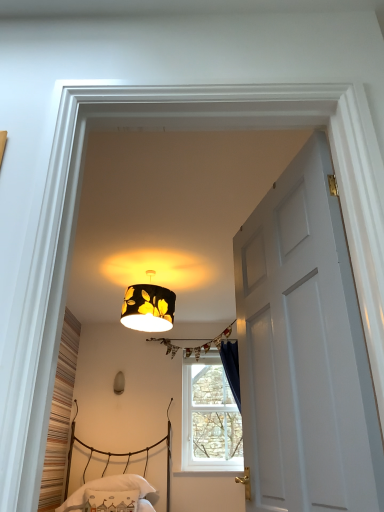
Find the location of `vacant region above white fabric pillow at lower center (from a real-world perspective)`. vacant region above white fabric pillow at lower center (from a real-world perspective) is located at coordinates (119, 482).